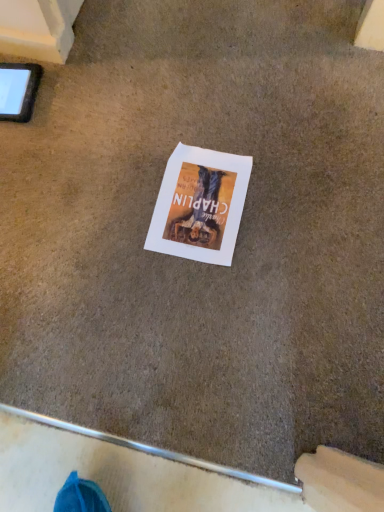
At what (x,y) coordinates should I click in order to perform the action: click on unoccupied space behind white paper at center. Please return your answer as a coordinate pair (x, y). This screenshot has width=384, height=512. Looking at the image, I should click on (194, 122).